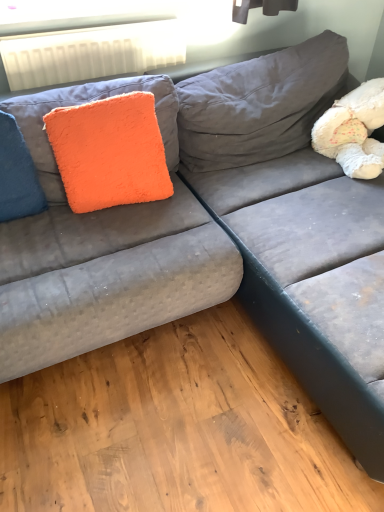
I want to click on free space above white plastic radiator at upper left (from a real-world perspective), so click(x=96, y=24).